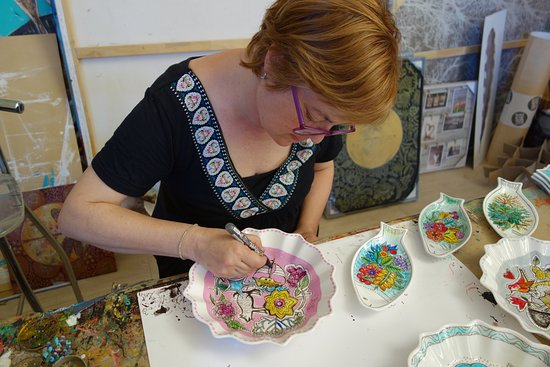
Where is `framed artwork`? The width and height of the screenshot is (550, 367). framed artwork is located at coordinates [x=394, y=151].